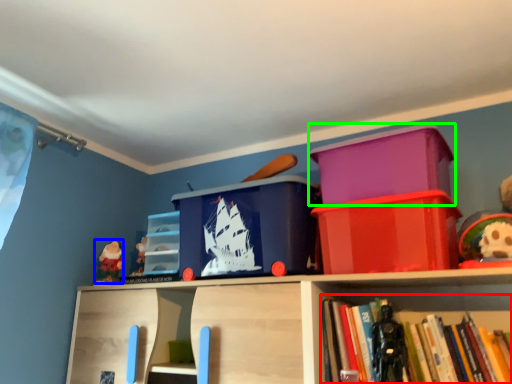
Question: Based on their relative distances, which object is farther from book (highlighted by a red box)? Choose from toy (highlighted by a blue box) and storage box (highlighted by a green box).

Choices:
 (A) toy
 (B) storage box

Answer: (A)